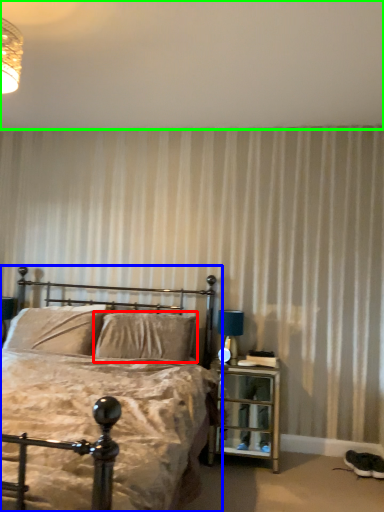
Question: Which object is the closest to the pillow (highlighted by a red box)? Choose among these: bed (highlighted by a blue box) or backdrop (highlighted by a green box).

Choices:
 (A) bed
 (B) backdrop

Answer: (A)